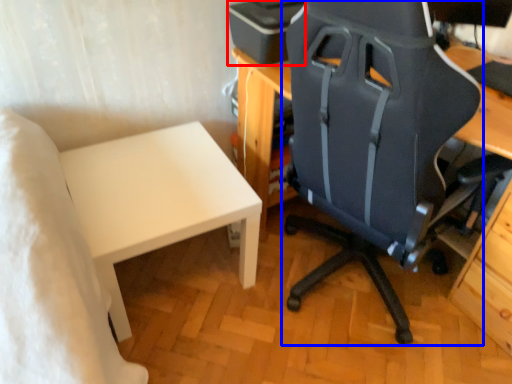
Question: Which object appears closest to the camera in this image, printer (highlighted by a red box) or chair (highlighted by a blue box)?

Choices:
 (A) printer
 (B) chair

Answer: (B)